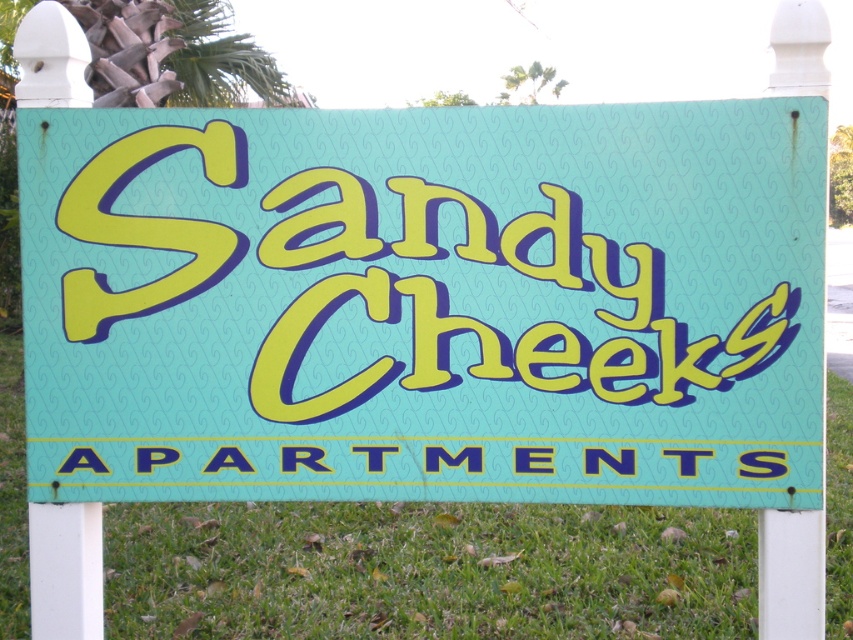
Who is lower down, teal matte signboard at center or blue plastic text at center?

blue plastic text at center is lower down.

Is teal matte signboard at center closer to camera compared to blue plastic text at center?

Yes, teal matte signboard at center is in front of blue plastic text at center.

Where is `teal matte signboard at center`? teal matte signboard at center is located at coordinates (425, 304).

The image size is (853, 640). Identify the location of teal matte signboard at center. (425, 304).

Who is positioned more to the left, teal matte signboard at center or green grass at center?

green grass at center

How distant is teal matte signboard at center from green grass at center?

teal matte signboard at center is 6.02 feet from green grass at center.

Which is in front, point (117, 236) or point (12, 436)?

Point (117, 236) is more forward.

The width and height of the screenshot is (853, 640). Find the location of `teal matte signboard at center`. teal matte signboard at center is located at coordinates (425, 304).

Who is lower down, green grass at center or blue plastic text at center?

green grass at center is below.

Where is `green grass at center`? green grass at center is located at coordinates (425, 570).